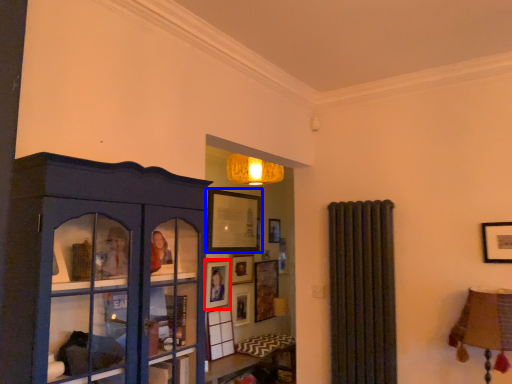
Question: Which object appears closest to the camera in this image, picture frame (highlighted by a red box) or picture frame (highlighted by a blue box)?

Choices:
 (A) picture frame
 (B) picture frame

Answer: (A)